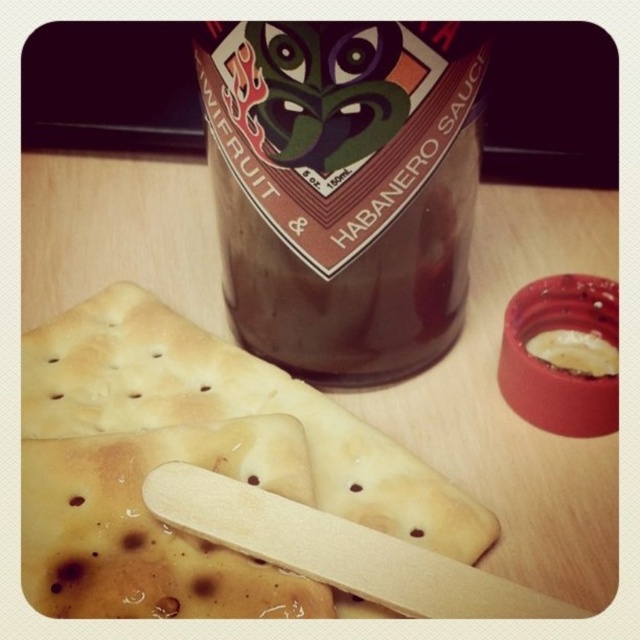
Question: Which point is farther from the camera taking this photo?

Choices:
 (A) (548, 360)
 (B) (492, 525)

Answer: (A)

Question: Is the position of crusty white cracker at center more distant than that of yellowish creamy spread at upper right?

Choices:
 (A) no
 (B) yes

Answer: (A)

Question: Is crusty white cracker at center above yellowish creamy spread at upper right?

Choices:
 (A) yes
 (B) no

Answer: (B)

Question: Does brown glass bottle at center appear over yellowish creamy spread at upper right?

Choices:
 (A) yes
 (B) no

Answer: (A)

Question: Among these objects, which one is nearest to the camera?

Choices:
 (A) yellowish creamy spread at upper right
 (B) crusty white cracker at center

Answer: (B)

Question: Which is farther from the brown glass bottle at center?

Choices:
 (A) crusty white cracker at center
 (B) yellowish creamy spread at upper right

Answer: (B)